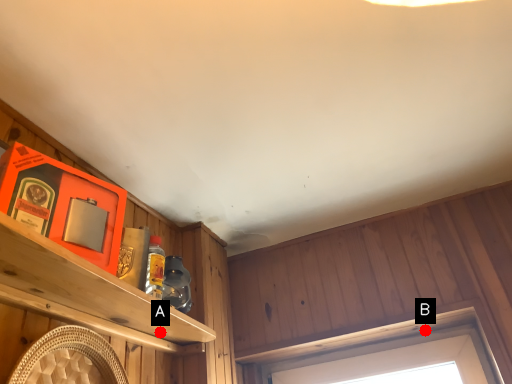
Question: Two points are circled on the image, labeled by A and B beside each circle. Which point is further to the camera?

Choices:
 (A) A is further
 (B) B is further

Answer: (B)